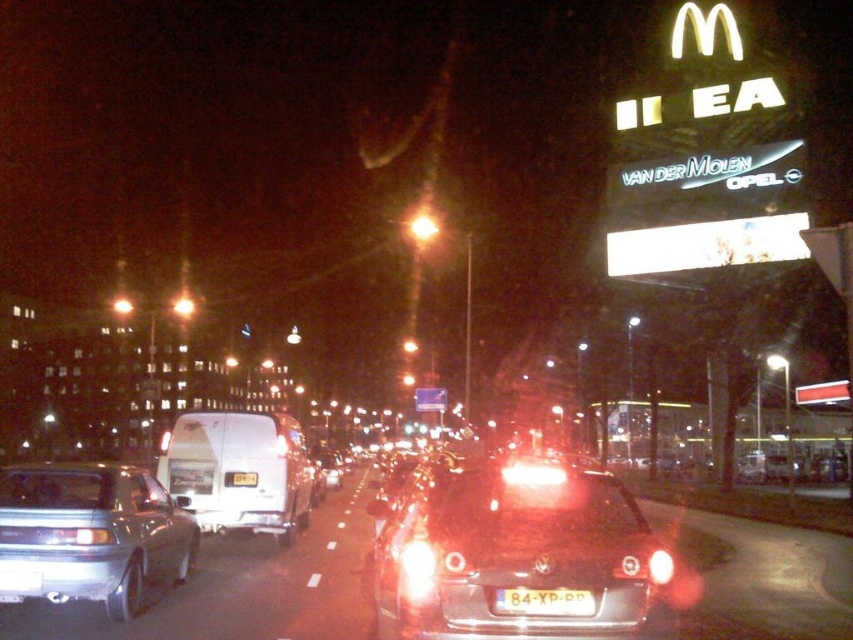
Question: From the image, what is the correct spatial relationship of white matte van at center in relation to yellow matte license plate at center?

Choices:
 (A) below
 (B) above

Answer: (A)

Question: Based on their relative distances, which object is nearer to the white matte van at center?

Choices:
 (A) silver metallic sedan at left
 (B) matte red headlight at center
 (C) glossy plastic car at center
 (D) white plastic license plate at center

Answer: (C)

Question: Which point is closer to the camera?

Choices:
 (A) (233, 486)
 (B) (553, 554)

Answer: (B)

Question: Which of the following is the farthest from the observer?

Choices:
 (A) (199, 493)
 (B) (662, 548)
 (C) (241, 483)
 (D) (585, 470)

Answer: (C)

Question: From the image, what is the correct spatial relationship of silver metallic sedan at left in relation to white plastic license plate at center?

Choices:
 (A) above
 (B) below

Answer: (B)

Question: Is silver metallic sedan at left positioned behind white matte van at center?

Choices:
 (A) yes
 (B) no

Answer: (B)